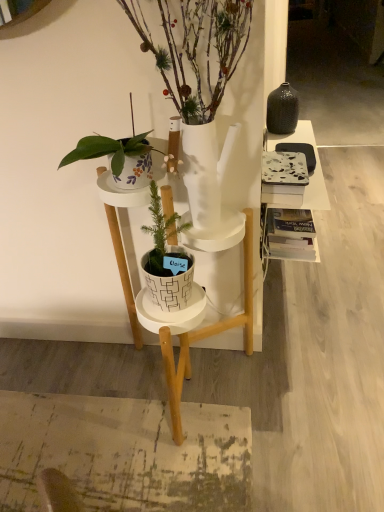
Locate an element on the screen. Image resolution: width=384 pixels, height=512 pixels. free spot in front of white matte plant stand at center is located at coordinates (171, 476).